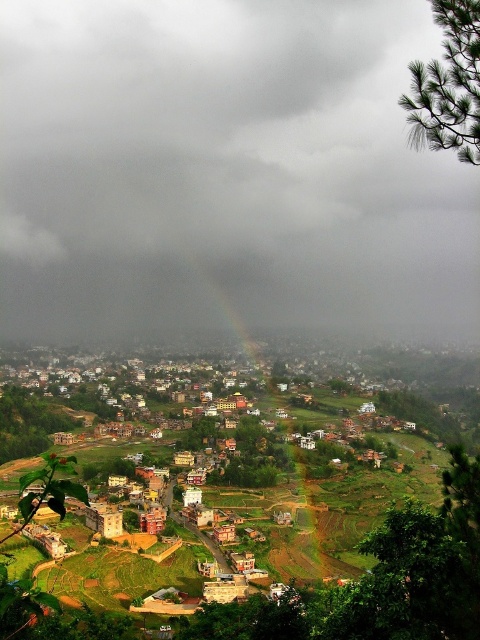
How far apart are cloudy gray sky at upper center and multicolored clay houses at center?

cloudy gray sky at upper center and multicolored clay houses at center are 320.02 meters apart.

Which is below, cloudy gray sky at upper center or multicolored clay houses at center?

Positioned lower is multicolored clay houses at center.

You are a GUI agent. You are given a task and a screenshot of the screen. Output one action in this format:
    pyautogui.click(x=<x>, y=<y>)
    Task: Click on the cloudy gray sky at upper center
    The width and height of the screenshot is (480, 640).
    Given the screenshot: What is the action you would take?
    pyautogui.click(x=226, y=173)

Measure the distance between cloudy gray sky at upper center and camera.

A distance of 1771.15 feet exists between cloudy gray sky at upper center and camera.

Does point (103, 301) come behind point (218, 481)?

Yes, it is.

Where is `cloudy gray sky at upper center`? The image size is (480, 640). cloudy gray sky at upper center is located at coordinates (226, 173).

Who is more forward, (249, 477) or (218, 492)?

Positioned in front is point (218, 492).

Who is higher up, rainbow at center or multicolored clay houses at center?

rainbow at center

What do you see at coordinates (284, 529) in the screenshot?
I see `rainbow at center` at bounding box center [284, 529].

Where is `rainbow at center`? The height and width of the screenshot is (640, 480). rainbow at center is located at coordinates (284, 529).